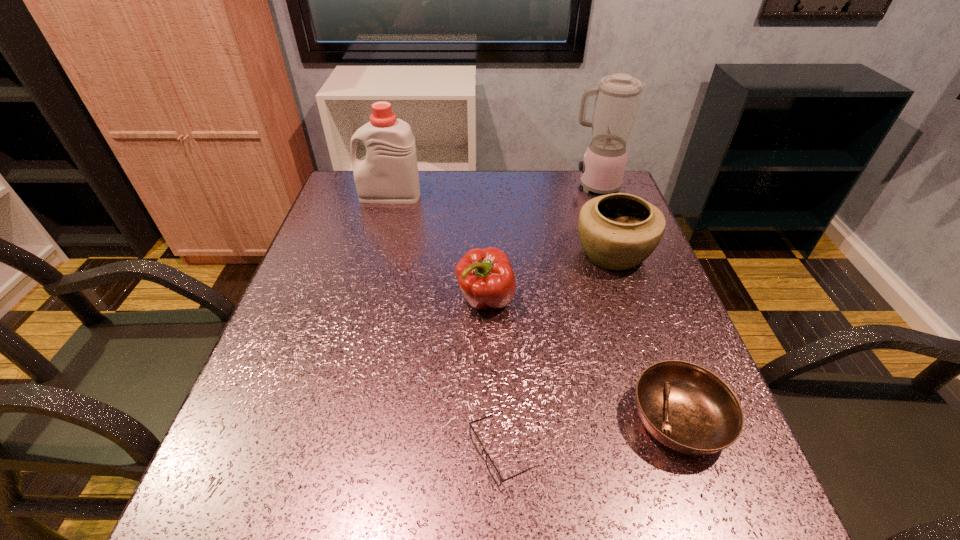
What are the coordinates of `free space located 0.070m on the handle side of the leftmost object` in the screenshot? It's located at (335, 196).

At what (x,y) coordinates should I click in order to perform the action: click on free space located 0.340m on the left of the pottery. Please return your answer as a coordinate pair (x, y). The width and height of the screenshot is (960, 540). Looking at the image, I should click on (435, 254).

I want to click on free space located on the back of the pepper, so pos(485,255).

Where is `vacant area located on the back of the soup bowl`? The width and height of the screenshot is (960, 540). vacant area located on the back of the soup bowl is located at coordinates (620, 256).

Where is `free space located 0.160m with the lenses facing outward on the shortest object`? This screenshot has height=540, width=960. free space located 0.160m with the lenses facing outward on the shortest object is located at coordinates (371, 451).

The height and width of the screenshot is (540, 960). I want to click on blank area located 0.160m with the lenses facing outward on the shortest object, so click(x=371, y=451).

The image size is (960, 540). In order to click on vacant area located 0.050m with the lenses facing outward on the shortest object in this screenshot , I will do `click(438, 451)`.

Where is `food processor that is at the far edge`? The width and height of the screenshot is (960, 540). food processor that is at the far edge is located at coordinates (617, 100).

This screenshot has height=540, width=960. I want to click on detergent positioned at the far edge, so tap(388, 174).

The height and width of the screenshot is (540, 960). Find the location of `object that is at the near edge`. object that is at the near edge is located at coordinates (491, 467).